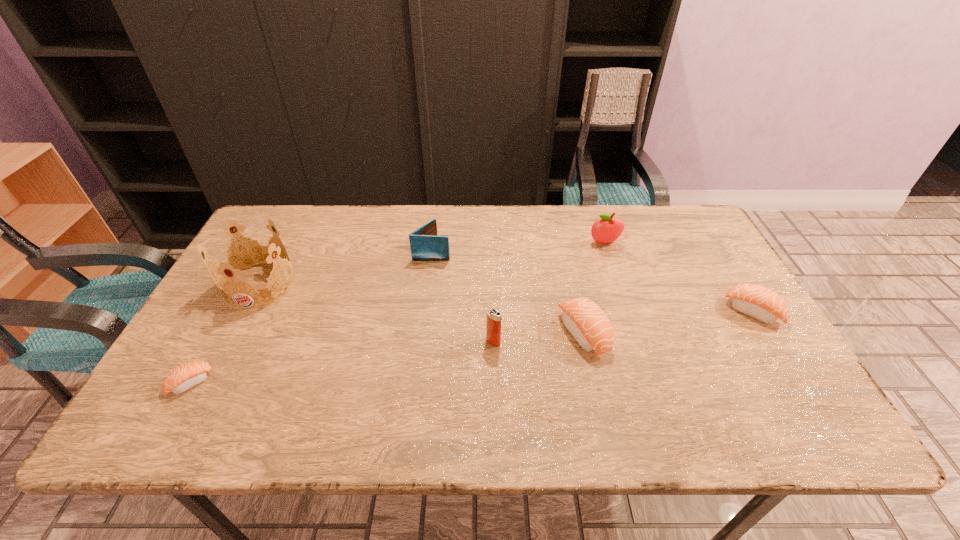
Please point a spot to place another sushi for symmetrical spacing. Please provide its 2D coordinates. Your answer should be formatted as a tuple, i.e. [(x, y)], where the tuple contains the x and y coordinates of a point satisfying the conditions above.

[(396, 357)]